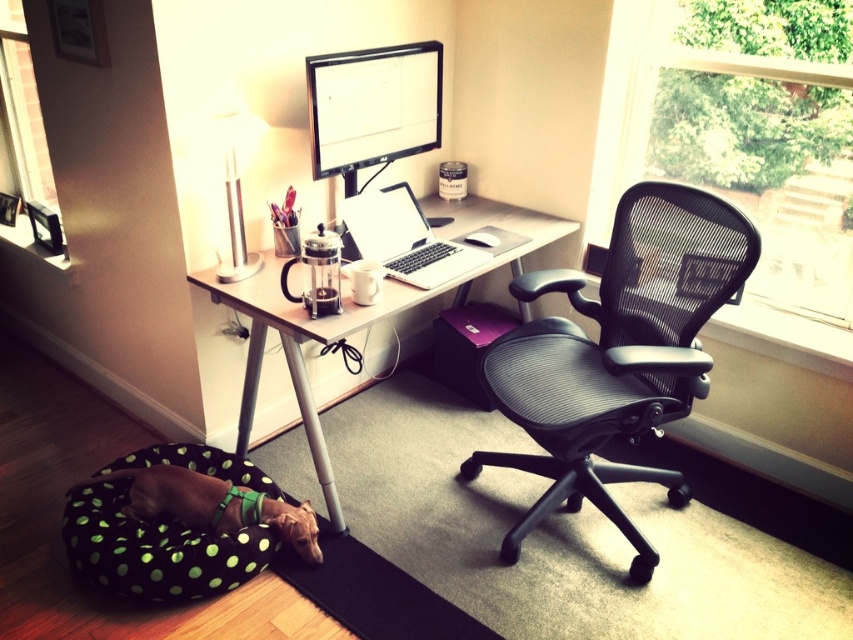
You are standing at the entrance of the home office and want to sit down at the desk. Based on the layout, where is the black mesh swivel chair at center positioned relative to the desk?

The black mesh swivel chair at center is positioned in front of the desk, as it is located at point coordinates that place it directly facing the desk area.

From the picture: You are organizing a small gathering in this home office and need to place a 1.2 meter wide board game on the available surfaces. Can the white plastic table at center or the green dotted fabric dog bed at lower left accommodate the board game?

The white plastic table at center might be wider than green dotted fabric dog bed at lower left, so it is possible that the white plastic table at center can accommodate the 1.2 meter wide board game, but the green dotted fabric dog bed at lower left is likely too narrow.

You are standing at the entrance of the home office and want to sit down at the desk. Which object at point (x=618, y=353) should you approach to ensure you can sit comfortably?

The black mesh swivel chair at center is located at point (x=618, y=353), so you should approach that object to sit comfortably.